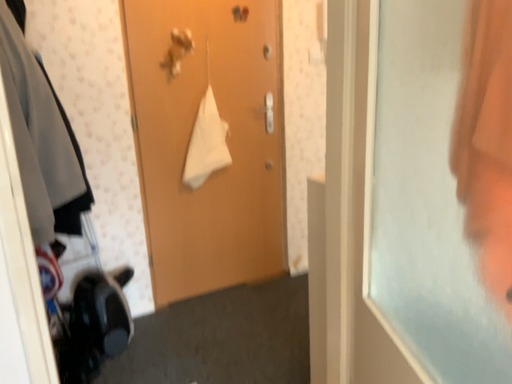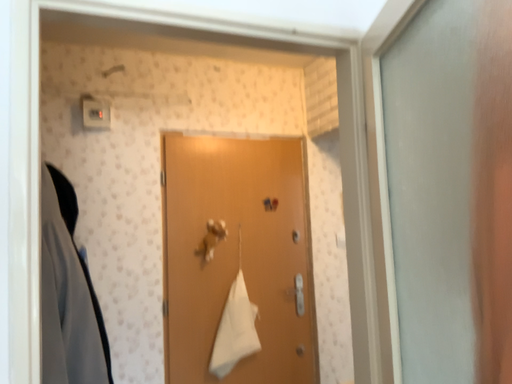
Question: Which way did the camera rotate in the video?

Choices:
 (A) rotated downward
 (B) rotated upward

Answer: (B)